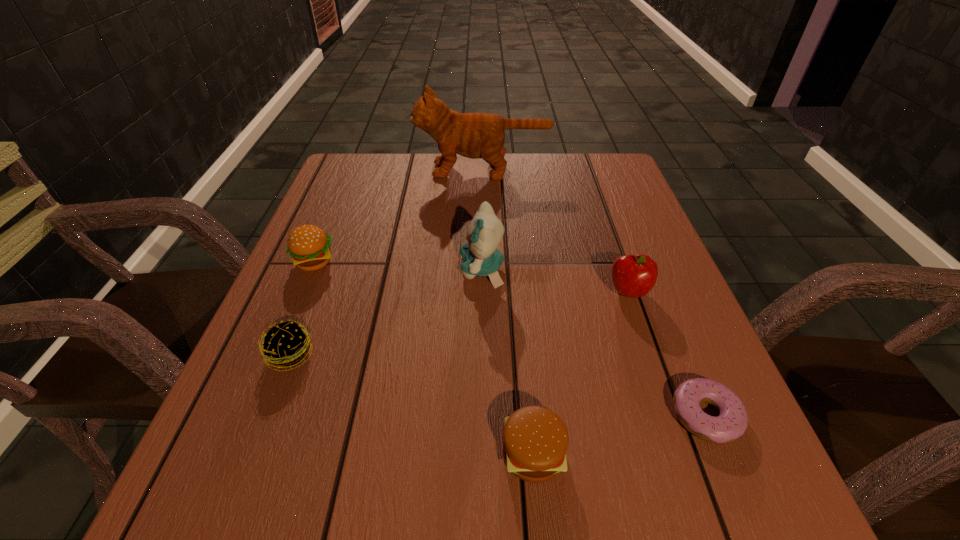
Find the location of a particular element. Image resolution: width=960 pixels, height=540 pixels. the tallest object is located at coordinates pyautogui.click(x=473, y=135).

Identify the location of the farthest object. The width and height of the screenshot is (960, 540). (473, 135).

The height and width of the screenshot is (540, 960). What are the coordinates of `kitten` in the screenshot? It's located at (480, 256).

The width and height of the screenshot is (960, 540). In order to click on apple in this screenshot , I will do coord(634,276).

The image size is (960, 540). I want to click on the taller hamburger, so click(309, 247).

In order to click on the left hamburger in this screenshot , I will do `click(309, 247)`.

Identify the location of patty. The height and width of the screenshot is (540, 960). (285, 344).

This screenshot has width=960, height=540. Find the location of `the nearer hamburger`. the nearer hamburger is located at coordinates (535, 440).

In order to click on the shorter hamburger in this screenshot , I will do `click(535, 440)`.

The height and width of the screenshot is (540, 960). I want to click on doughnut, so click(x=731, y=423).